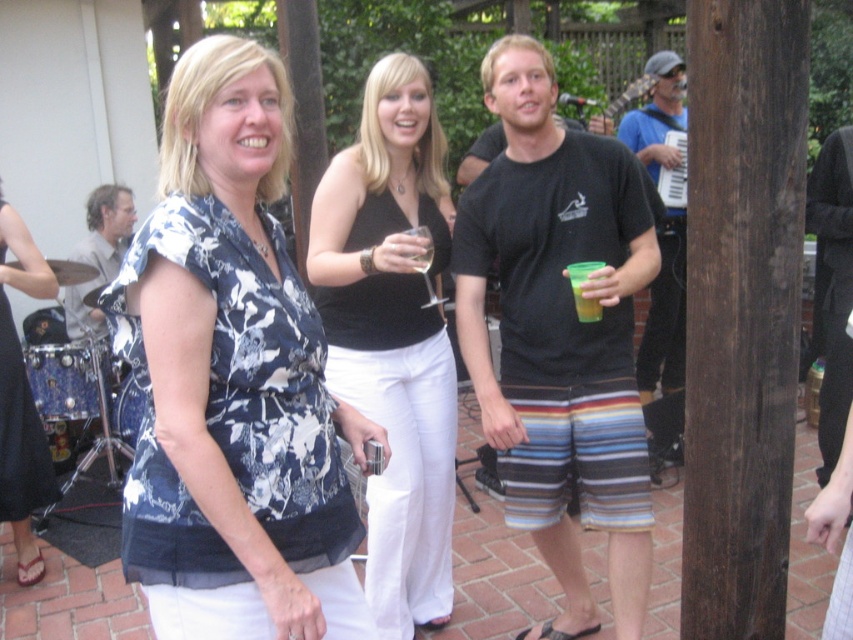
Question: Considering the relative positions of floral fabric blouse at center and matte floral blouse at center in the image provided, where is floral fabric blouse at center located with respect to matte floral blouse at center?

Choices:
 (A) left
 (B) right

Answer: (B)

Question: Is black cotton t-shirt at center smaller than blue fabric accordion at right?

Choices:
 (A) yes
 (B) no

Answer: (B)

Question: Can you confirm if black matte tank top at center is positioned to the right of matte floral blouse at center?

Choices:
 (A) no
 (B) yes

Answer: (B)

Question: Which point appears farthest from the camera in this image?

Choices:
 (A) (117, 252)
 (B) (677, 122)
 (C) (44, 456)

Answer: (A)

Question: Which point appears closest to the camera in this image?

Choices:
 (A) (401, 534)
 (B) (48, 460)
 (C) (635, 113)
 (D) (200, 500)

Answer: (D)

Question: Which of the following is the farthest from the observer?

Choices:
 (A) (660, 131)
 (B) (119, 264)
 (C) (526, 500)

Answer: (B)